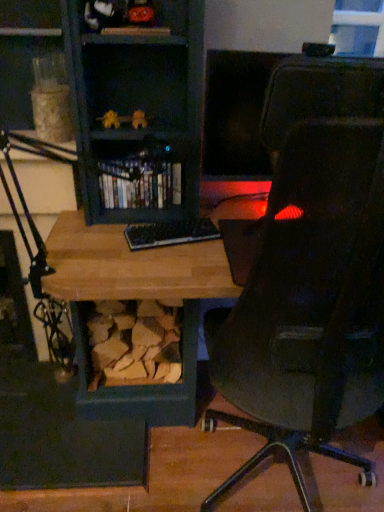
At what (x,y) coordinates should I click in order to perform the action: click on free location to the left of black plastic keyboard at center. Please return your answer as a coordinate pair (x, y). Looking at the image, I should click on (100, 243).